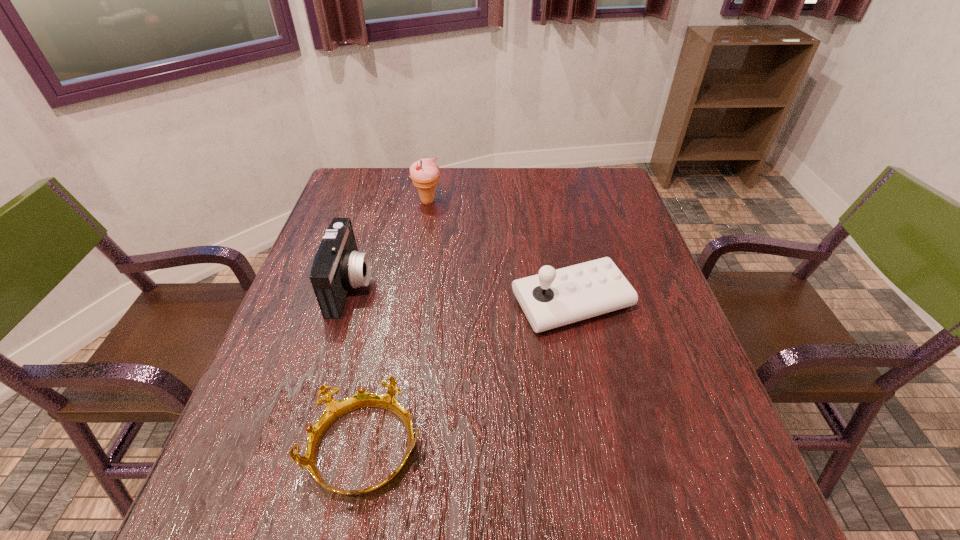
The image size is (960, 540). I want to click on icecream, so click(425, 172).

What are the coordinates of `camcorder` in the screenshot? It's located at (338, 266).

Identify the location of joystick. The width and height of the screenshot is (960, 540). tap(553, 298).

Image resolution: width=960 pixels, height=540 pixels. In order to click on crown in this screenshot , I will do `click(335, 409)`.

You are a GUI agent. You are given a task and a screenshot of the screen. Output one action in this format:
    pyautogui.click(x=<x>, y=<y>)
    Task: Click on the nearest object
    The height and width of the screenshot is (540, 960).
    Given the screenshot: What is the action you would take?
    pyautogui.click(x=335, y=409)

Where is `vacant space situated 0.250m on the front of the farthest object`? The width and height of the screenshot is (960, 540). vacant space situated 0.250m on the front of the farthest object is located at coordinates (418, 265).

The image size is (960, 540). What are the coordinates of `blank space located on the lens of the camcorder` in the screenshot? It's located at (514, 286).

You are a GUI agent. You are given a task and a screenshot of the screen. Output one action in this format:
    pyautogui.click(x=<x>, y=<y>)
    Task: Click on the vacant space located on the back of the rightmost object
    
    Given the screenshot: What is the action you would take?
    pyautogui.click(x=550, y=198)

Identify the location of free spot located 0.150m on the left of the nearest object. (223, 449).

This screenshot has width=960, height=540. I want to click on object located in the far edge section of the desktop, so click(x=425, y=172).